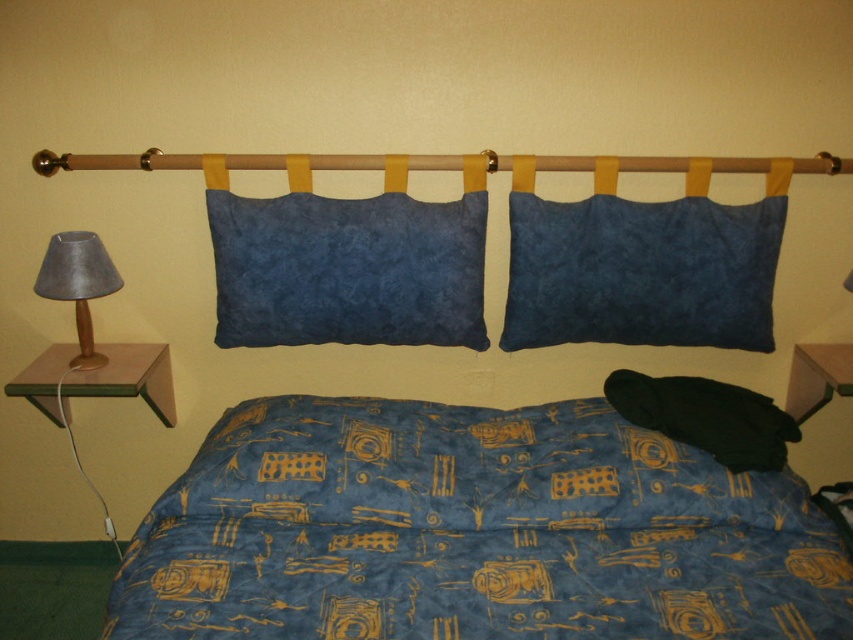
Looking at this image, between blue printed fabric quilt at center and matte gray lampshade at left, which one is positioned lower?

Positioned lower is blue printed fabric quilt at center.

Is blue printed fabric quilt at center shorter than matte gray lampshade at left?

No, blue printed fabric quilt at center is not shorter than matte gray lampshade at left.

Is point (531, 547) behind point (86, 268)?

No.

The width and height of the screenshot is (853, 640). I want to click on blue printed fabric quilt at center, so click(473, 532).

Is blue printed fabric quilt at center smaller than dark blue suede pillow at upper center?

Incorrect, blue printed fabric quilt at center is not smaller in size than dark blue suede pillow at upper center.

Find the location of a particular element. The image size is (853, 640). blue printed fabric quilt at center is located at coordinates (473, 532).

Where is `blue printed fabric quilt at center`? This screenshot has height=640, width=853. blue printed fabric quilt at center is located at coordinates (473, 532).

Between dark blue suede pillow at upper center and matte gray lampshade at left, which one appears on the right side from the viewer's perspective?

dark blue suede pillow at upper center

What do you see at coordinates (641, 272) in the screenshot?
I see `dark blue suede pillow at upper center` at bounding box center [641, 272].

Where is `dark blue suede pillow at upper center`? The image size is (853, 640). dark blue suede pillow at upper center is located at coordinates (641, 272).